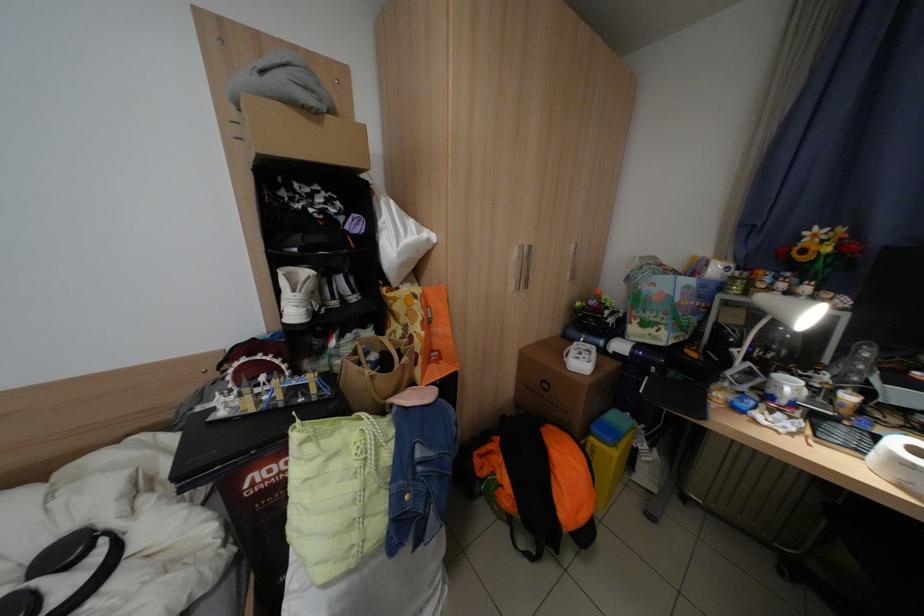
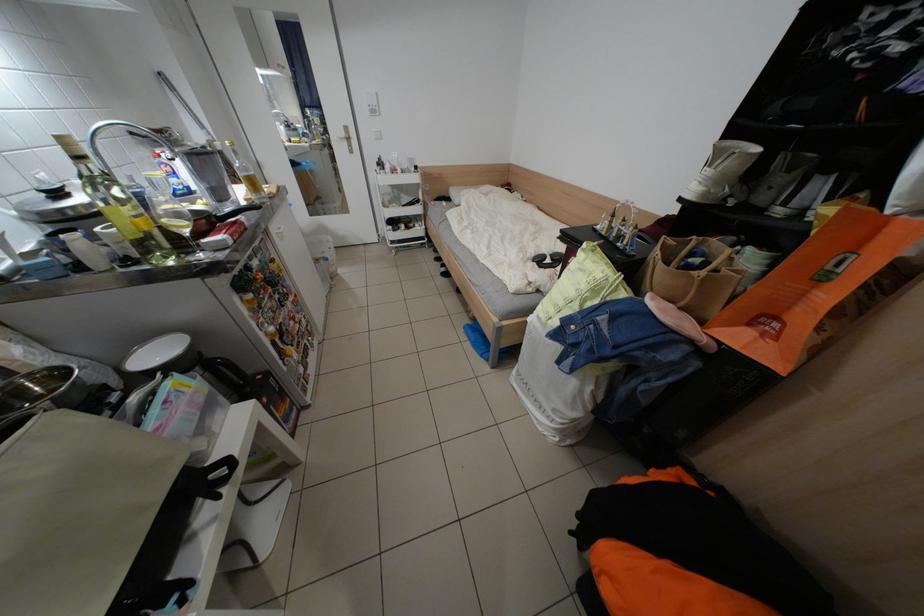
The point at [447,363] is marked in the first image. Where is the corresponding point in the second image?

(775, 334)